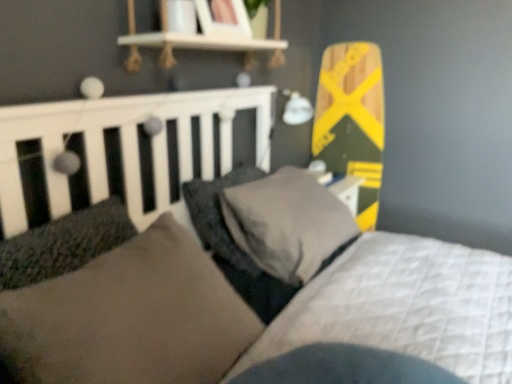
Question: Which direction should I rotate to face dark gray textured pillow at center, the first pillow viewed from the back, — up or down?

Choices:
 (A) down
 (B) up

Answer: (A)

Question: Is suede-like brown pillow at center, the third pillow from the back, to the left of yellow-green wood skateboard at upper right from the viewer's perspective?

Choices:
 (A) no
 (B) yes

Answer: (B)

Question: Is suede-like brown pillow at center, the third pillow from the back, looking in the opposite direction of yellow-green wood skateboard at upper right?

Choices:
 (A) no
 (B) yes

Answer: (A)

Question: Does suede-like brown pillow at center, which is the first pillow in front-to-back order, contain yellow-green wood skateboard at upper right?

Choices:
 (A) yes
 (B) no

Answer: (B)

Question: From the image's perspective, does suede-like brown pillow at center, which is the first pillow in front-to-back order, appear higher than yellow-green wood skateboard at upper right?

Choices:
 (A) no
 (B) yes

Answer: (A)

Question: Considering the relative positions of suede-like brown pillow at center, the third pillow from the back, and yellow-green wood skateboard at upper right in the image provided, is suede-like brown pillow at center, the third pillow from the back, in front of yellow-green wood skateboard at upper right?

Choices:
 (A) no
 (B) yes

Answer: (B)

Question: Can you confirm if suede-like brown pillow at center, which is the first pillow in front-to-back order, is smaller than yellow-green wood skateboard at upper right?

Choices:
 (A) yes
 (B) no

Answer: (B)

Question: From a real-world perspective, is yellow-green wood skateboard at upper right beneath dark gray plush pillow at center, the second pillow positioned from the front?

Choices:
 (A) yes
 (B) no

Answer: (B)

Question: Is yellow-green wood skateboard at upper right oriented away from dark gray plush pillow at center, the second pillow positioned from the front?

Choices:
 (A) yes
 (B) no

Answer: (B)

Question: Considering the relative sizes of yellow-green wood skateboard at upper right and dark gray plush pillow at center, the second pillow viewed from the back, in the image provided, is yellow-green wood skateboard at upper right taller than dark gray plush pillow at center, the second pillow viewed from the back,?

Choices:
 (A) no
 (B) yes

Answer: (B)

Question: Is yellow-green wood skateboard at upper right to the left of dark gray plush pillow at center, the second pillow viewed from the back, from the viewer's perspective?

Choices:
 (A) yes
 (B) no

Answer: (B)

Question: Is yellow-green wood skateboard at upper right positioned beyond the bounds of dark gray plush pillow at center, the second pillow positioned from the front?

Choices:
 (A) no
 (B) yes

Answer: (B)

Question: Is yellow-green wood skateboard at upper right at the right side of dark gray plush pillow at center, the second pillow positioned from the front?

Choices:
 (A) no
 (B) yes

Answer: (B)

Question: From a real-world perspective, is dark gray plush pillow at center, the second pillow viewed from the back, physically above suede-like brown pillow at center, which is the first pillow in front-to-back order?

Choices:
 (A) yes
 (B) no

Answer: (B)